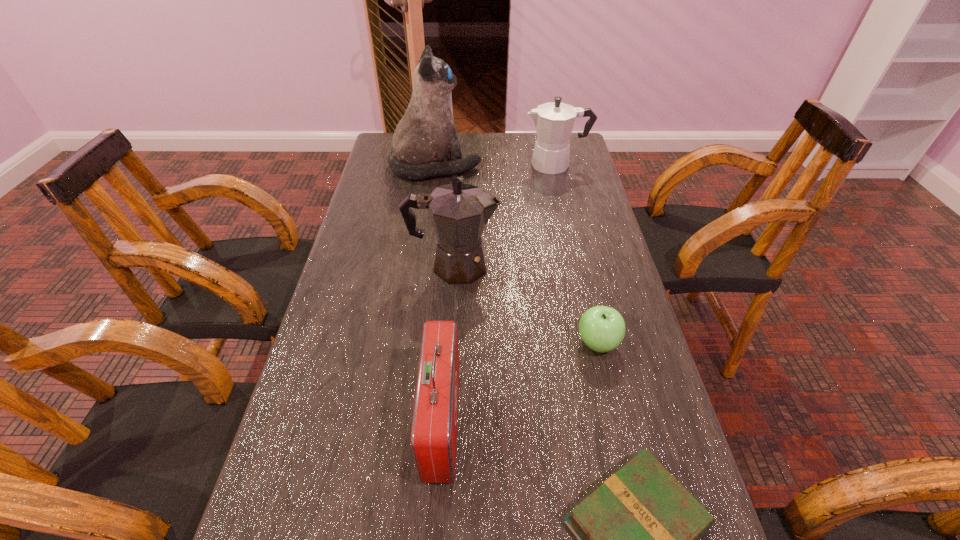
This screenshot has width=960, height=540. In order to click on object positioned at the far right corner in this screenshot , I will do `click(554, 121)`.

Image resolution: width=960 pixels, height=540 pixels. What are the coordinates of `vacant space at the far edge of the desktop` in the screenshot? It's located at (469, 144).

In the image, there is a desktop. At what (x,y) coordinates should I click in order to perform the action: click on free space at the left edge. Please return your answer as a coordinate pair (x, y). Looking at the image, I should click on (312, 434).

Where is `free region at the right edge of the desktop`? Image resolution: width=960 pixels, height=540 pixels. free region at the right edge of the desktop is located at coordinates (592, 234).

This screenshot has height=540, width=960. What are the coordinates of `blank space at the far right corner` in the screenshot? It's located at (581, 154).

Where is `empty location between the tallest object and the first-aid kit`? empty location between the tallest object and the first-aid kit is located at coordinates tap(439, 294).

Find the location of a particular element. This screenshot has height=540, width=960. free space between the apple and the cat is located at coordinates (516, 255).

Identify the location of vacant space that is in between the third nearest object and the farther coffeepot. This screenshot has height=540, width=960. (577, 254).

Locate an element on the screen. The height and width of the screenshot is (540, 960). free space between the right coffeepot and the cat is located at coordinates (495, 166).

Locate which object is the fifth closest to the tallest object. Please provide its 2D coordinates. Your answer should be formatted as a tuple, i.e. [(x, y)], where the tuple contains the x and y coordinates of a point satisfying the conditions above.

[(638, 534)]